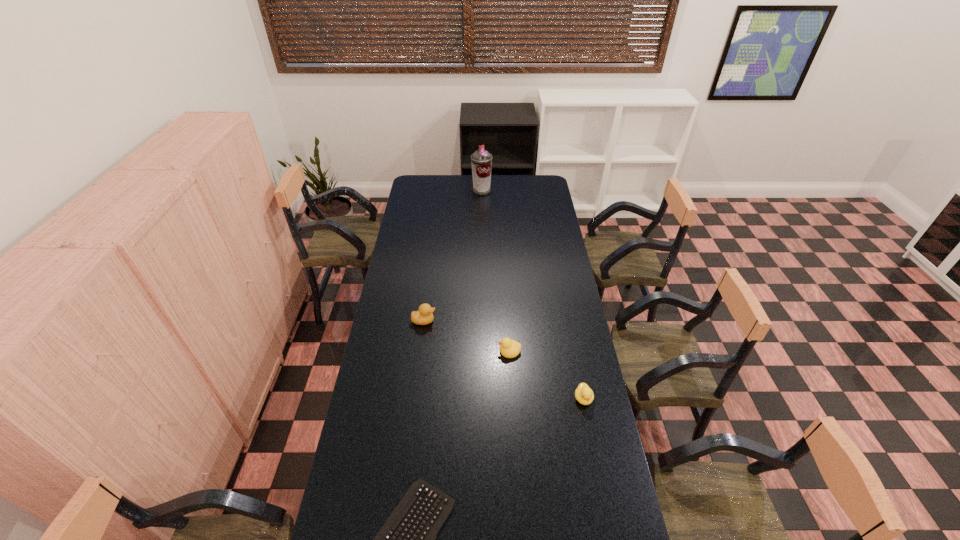
At what (x,y) coordinates should I click in order to perform the action: click on the farthest object. Please return your answer as a coordinate pair (x, y). The image size is (960, 540). Looking at the image, I should click on (481, 160).

Locate an element on the screen. This screenshot has width=960, height=540. the tallest object is located at coordinates (481, 160).

The image size is (960, 540). Identify the location of the fourth nearest object. (424, 316).

At what (x,y) coordinates should I click in order to perform the action: click on the fourth shortest object. Please return your answer as a coordinate pair (x, y). Looking at the image, I should click on (424, 316).

This screenshot has height=540, width=960. I want to click on the rightmost duckling, so click(584, 395).

This screenshot has height=540, width=960. Identify the location of the nearest duckling. (584, 395).

What are the coordinates of `the third farthest object` in the screenshot? It's located at (509, 348).

This screenshot has height=540, width=960. Identify the location of the second nearest duckling. (509, 348).

This screenshot has height=540, width=960. Identify the location of vacant space located 0.200m on the left of the farthest object. (x=439, y=191).

What are the coordinates of `blank space located 0.070m facing forward on the leftmost duckling` in the screenshot? It's located at (452, 321).